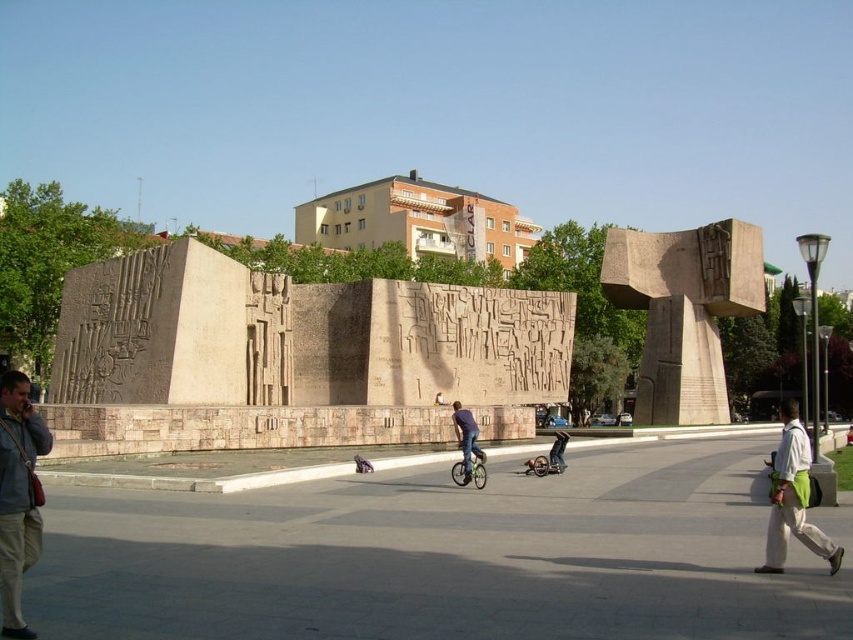
Is smooth gray stone sculpture at center bigger than gray fabric jacket at lower left?

Yes.

Between smooth gray stone sculpture at center and gray fabric jacket at lower left, which one is positioned higher?

smooth gray stone sculpture at center

Describe the element at coordinates (683, 310) in the screenshot. Image resolution: width=853 pixels, height=640 pixels. I see `smooth gray stone sculpture at center` at that location.

Where is `smooth gray stone sculpture at center`? Image resolution: width=853 pixels, height=640 pixels. smooth gray stone sculpture at center is located at coordinates (683, 310).

The width and height of the screenshot is (853, 640). What do you see at coordinates (16, 496) in the screenshot? I see `gray fabric jacket at lower left` at bounding box center [16, 496].

Does gray fabric jacket at lower left have a larger size compared to white cotton shirt at lower right?

Incorrect, gray fabric jacket at lower left is not larger than white cotton shirt at lower right.

Between point (19, 625) and point (775, 550), which one is positioned behind?

The point (775, 550) is more distant.

Identify the location of gray fabric jacket at lower left. The image size is (853, 640). (16, 496).

Consider the image. Does smooth gray stone sculpture at center have a lesser width compared to denim pants at center?

No.

The width and height of the screenshot is (853, 640). Find the location of `smooth gray stone sculpture at center`. smooth gray stone sculpture at center is located at coordinates (683, 310).

Describe the element at coordinates (683, 310) in the screenshot. Image resolution: width=853 pixels, height=640 pixels. I see `smooth gray stone sculpture at center` at that location.

You are a GUI agent. You are given a task and a screenshot of the screen. Output one action in this format:
    pyautogui.click(x=<x>, y=<y>)
    Task: Click on the smooth gray stone sculpture at center
    This screenshot has height=640, width=853.
    Given the screenshot: What is the action you would take?
    pyautogui.click(x=683, y=310)